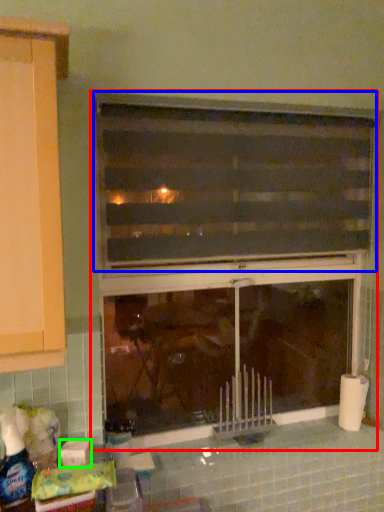
Question: Considering the real-world distances, which object is closest to window (highlighted by a red box)? window (highlighted by a blue box) or toilet paper (highlighted by a green box).

Choices:
 (A) window
 (B) toilet paper

Answer: (A)